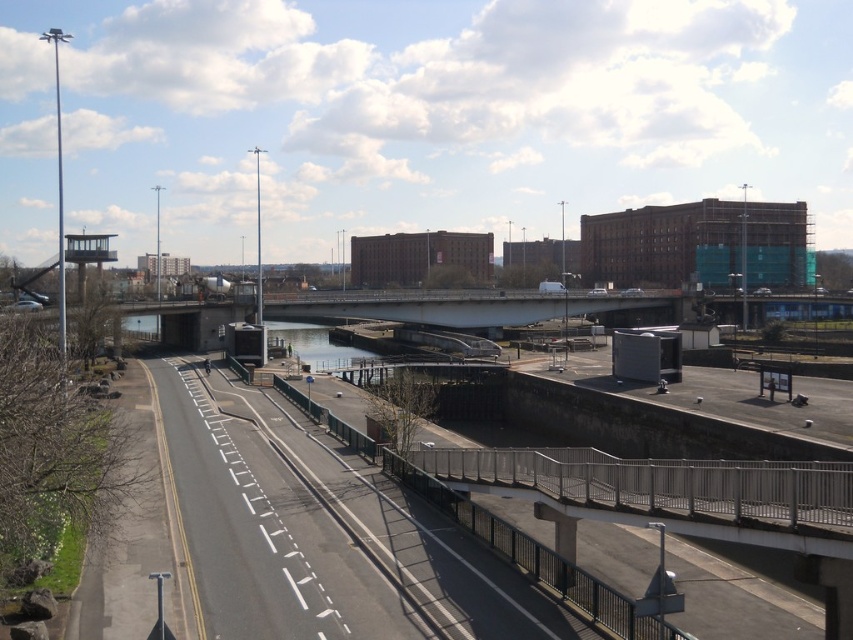
Question: Does white concrete bridge at center have a smaller size compared to clear water at center?

Choices:
 (A) yes
 (B) no

Answer: (B)

Question: Does white concrete bridge at center appear on the right side of clear water at center?

Choices:
 (A) no
 (B) yes

Answer: (B)

Question: Is white concrete bridge at center bigger than clear water at center?

Choices:
 (A) yes
 (B) no

Answer: (A)

Question: Which of the following is the farthest from the observer?

Choices:
 (A) clear water at center
 (B) white concrete bridge at center

Answer: (B)

Question: Which object is farther from the camera taking this photo?

Choices:
 (A) clear water at center
 (B) white concrete bridge at center

Answer: (B)